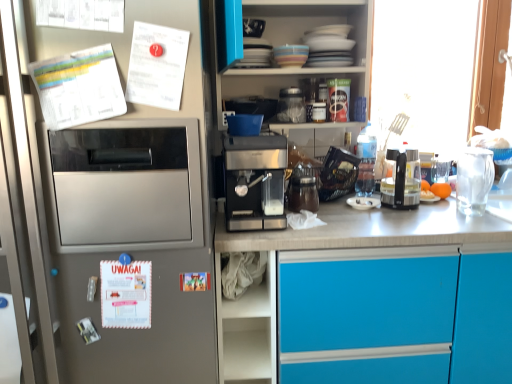
Find the location of a particular element. Image resolution: width=512 pixels, height=384 pixels. vacant area to the right of brown matte jar at center, marked as the 3th appliance in a top-to-bottom arrangement is located at coordinates (339, 207).